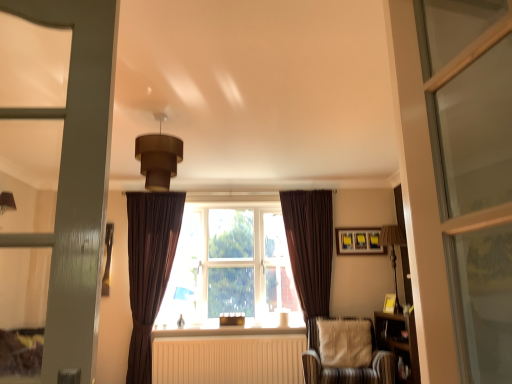
Question: Considering the positions of point (271, 370) and point (391, 352), is point (271, 370) closer or farther from the camera than point (391, 352)?

Choices:
 (A) farther
 (B) closer

Answer: (A)

Question: Looking at their shapes, would you say white matte radiator at center is wider or thinner than striped fabric chair at lower right?

Choices:
 (A) thin
 (B) wide

Answer: (A)

Question: Considering the real-world distances, which object is farthest from the matte yellow picture frame at upper right?

Choices:
 (A) wooden bookshelf at right
 (B) brown fabric window at center
 (C) wooden lampshade at right, marked as the 2th light fixture in a front-to-back arrangement
 (D) striped fabric chair at lower right
 (E) white painted wood at center

Answer: (E)

Question: Which object is the farthest from the brown velvet curtain at right, which ranks as the 2th curtain in left-to-right order?

Choices:
 (A) matte yellow picture frame at upper right
 (B) white matte radiator at center
 (C) brown matte/soft pendant light at upper center, positioned as the first light fixture in left-to-right order
 (D) striped fabric chair at lower right
 (E) wooden bookshelf at right

Answer: (C)